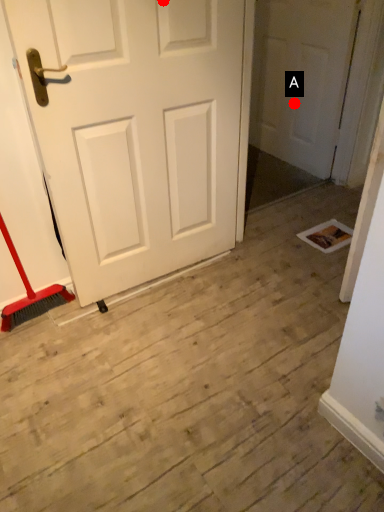
Question: Two points are circled on the image, labeled by A and B beside each circle. Which point appears closest to the camera in this image?

Choices:
 (A) A is closer
 (B) B is closer

Answer: (B)